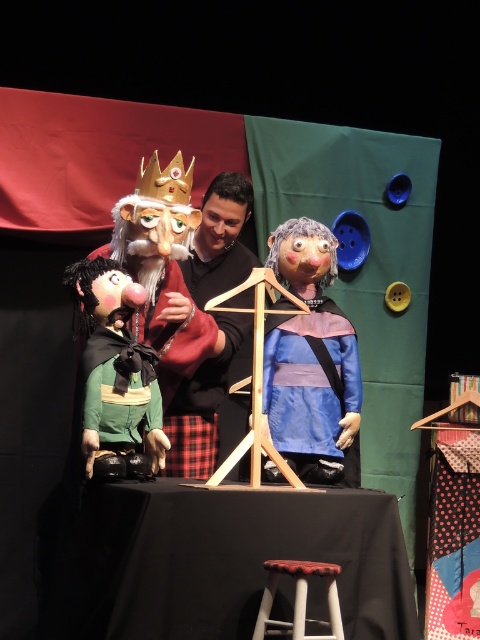
Question: Does black matte shirt at center come in front of wooden stool at lower center?

Choices:
 (A) yes
 (B) no

Answer: (B)

Question: Which object appears farthest from the camera in this image?

Choices:
 (A) matte green fabric doll at left
 (B) blue matte dress at center
 (C) black matte shirt at center

Answer: (C)

Question: Is black fabric table at center further to camera compared to wooden stool at lower center?

Choices:
 (A) yes
 (B) no

Answer: (A)

Question: Is black fabric table at center thinner than matte green fabric puppet at left?

Choices:
 (A) yes
 (B) no

Answer: (B)

Question: Which of the following is the farthest from the observer?

Choices:
 (A) coord(154,413)
 (B) coord(300,358)
 (C) coord(197,412)
 (D) coord(300,584)

Answer: (C)

Question: Which point is farther to the camera?

Choices:
 (A) (236, 237)
 (B) (97, 339)
 (C) (316, 547)

Answer: (A)